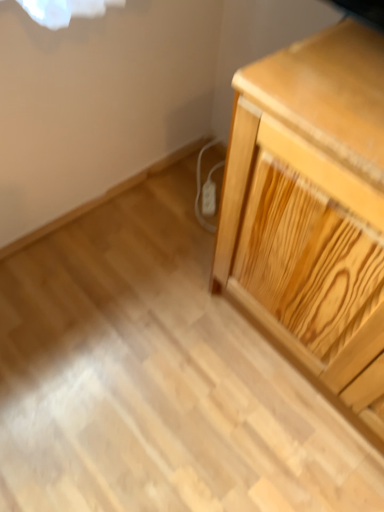
Image resolution: width=384 pixels, height=512 pixels. What are the coordinates of `white plastic electric outlet at lower center` in the screenshot? It's located at (x=208, y=198).

The image size is (384, 512). What do you see at coordinates (208, 198) in the screenshot?
I see `white plastic electric outlet at lower center` at bounding box center [208, 198].

The image size is (384, 512). Identify the location of light wood chest of drawers at right. (312, 210).

This screenshot has height=512, width=384. What do you see at coordinates (312, 210) in the screenshot?
I see `light wood chest of drawers at right` at bounding box center [312, 210].

The width and height of the screenshot is (384, 512). Identify the location of white plastic electric outlet at lower center. (208, 198).

Would you say light wood chest of drawers at right is to the left or to the right of white plastic electric outlet at lower center in the picture?

From the image, it's evident that light wood chest of drawers at right is to the right of white plastic electric outlet at lower center.

In the image, is light wood chest of drawers at right positioned in front of or behind white plastic electric outlet at lower center?

light wood chest of drawers at right is positioned closer to the viewer than white plastic electric outlet at lower center.

Considering the points (253, 199) and (208, 204), which point is behind, point (253, 199) or point (208, 204)?

The point (208, 204) is farther.

From the image's perspective, which is below, light wood chest of drawers at right or white plastic electric outlet at lower center?

light wood chest of drawers at right, from the image's perspective.

From a real-world perspective, is light wood chest of drawers at right positioned above or below white plastic electric outlet at lower center?

Clearly, from a real-world perspective, light wood chest of drawers at right is above white plastic electric outlet at lower center.

Is light wood chest of drawers at right thinner than white plastic electric outlet at lower center?

No.

Considering the sizes of objects light wood chest of drawers at right and white plastic electric outlet at lower center in the image provided, who is shorter, light wood chest of drawers at right or white plastic electric outlet at lower center?

white plastic electric outlet at lower center is shorter.

Can you confirm if light wood chest of drawers at right is bigger than white plastic electric outlet at lower center?

Correct, light wood chest of drawers at right is larger in size than white plastic electric outlet at lower center.

Could white plastic electric outlet at lower center be considered to be inside light wood chest of drawers at right?

Definitely not — white plastic electric outlet at lower center is not inside light wood chest of drawers at right.

Is the surface of light wood chest of drawers at right in direct contact with white plastic electric outlet at lower center?

No.

Is light wood chest of drawers at right oriented towards white plastic electric outlet at lower center?

No, light wood chest of drawers at right is not facing towards white plastic electric outlet at lower center.

How different are the orientations of light wood chest of drawers at right and white plastic electric outlet at lower center in degrees?

They differ by 47.5 degrees in their facing directions.

Image resolution: width=384 pixels, height=512 pixels. Identify the location of the chest of drawers located below the white plastic electric outlet at lower center (from the image's perspective). (312, 210).

Which is more to the left, white plastic electric outlet at lower center or light wood chest of drawers at right?

Positioned to the left is white plastic electric outlet at lower center.

Which object is more forward, white plastic electric outlet at lower center or light wood chest of drawers at right?

light wood chest of drawers at right is closer to the camera.

Which is behind, point (212, 184) or point (348, 344)?

The point (212, 184) is behind.

From the image's perspective, which one is positioned lower, white plastic electric outlet at lower center or light wood chest of drawers at right?

light wood chest of drawers at right is shown below in the image.

From the picture: From a real-world perspective, which object stands above the other?

In real-world perspective, light wood chest of drawers at right is above.

Which of these two, white plastic electric outlet at lower center or light wood chest of drawers at right, is thinner?

white plastic electric outlet at lower center is thinner.

Does white plastic electric outlet at lower center have a greater height compared to light wood chest of drawers at right?

No.

Looking at this image, is white plastic electric outlet at lower center bigger than light wood chest of drawers at right?

Actually, white plastic electric outlet at lower center might be smaller than light wood chest of drawers at right.

Is white plastic electric outlet at lower center inside the boundaries of light wood chest of drawers at right, or outside?

white plastic electric outlet at lower center is spatially situated outside light wood chest of drawers at right.

Would you consider white plastic electric outlet at lower center to be distant from light wood chest of drawers at right?

No, white plastic electric outlet at lower center is not far away from light wood chest of drawers at right.

Is white plastic electric outlet at lower center turned away from light wood chest of drawers at right?

No, white plastic electric outlet at lower center is not facing the opposite direction of light wood chest of drawers at right.

What's the angular difference between white plastic electric outlet at lower center and light wood chest of drawers at right's facing directions?

white plastic electric outlet at lower center and light wood chest of drawers at right are facing 47.5 degrees away from each other.

How distant is white plastic electric outlet at lower center from light wood chest of drawers at right?

They are 30.00 inches apart.

Locate an element on the screen. electric outlet above the light wood chest of drawers at right (from the image's perspective) is located at coordinates click(208, 198).

Locate an element on the screen. Image resolution: width=384 pixels, height=512 pixels. the chest of drawers in front of the white plastic electric outlet at lower center is located at coordinates (312, 210).

Find the location of a particular element. The height and width of the screenshot is (512, 384). the chest of drawers below the white plastic electric outlet at lower center (from the image's perspective) is located at coordinates (312, 210).